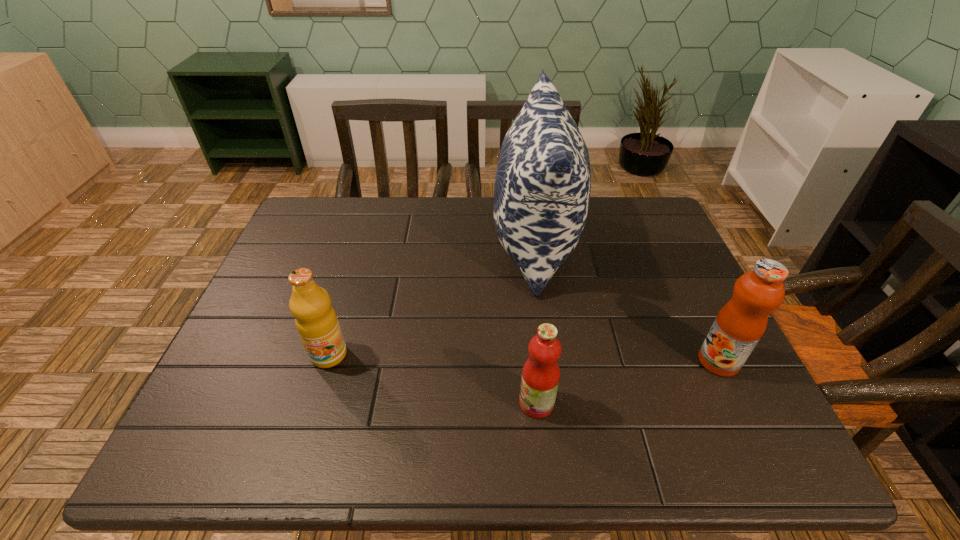
Locate an element on the screen. vacant region located 0.170m on the front label of the rightmost object is located at coordinates (621, 361).

The image size is (960, 540). In order to click on vacant space located on the front label of the rightmost object in this screenshot , I will do `click(676, 361)`.

Locate an element on the screen. vacant space located 0.110m on the front label of the leftmost fruit juice is located at coordinates (310, 416).

This screenshot has width=960, height=540. In order to click on free space located on the front label of the nearest object in this screenshot , I will do `click(361, 403)`.

I want to click on vacant area situated 0.340m on the front label of the nearest object, so click(351, 403).

The image size is (960, 540). What are the coordinates of `vacant space situated on the front label of the nearest object` in the screenshot? It's located at pos(460,403).

The image size is (960, 540). Identify the location of object at the far edge. (542, 187).

In order to click on object that is positioned at the right edge in this screenshot , I will do `click(741, 322)`.

In the image, there is a desktop. At what (x,y) coordinates should I click in order to perform the action: click on vacant space at the far edge. Please return your answer as a coordinate pair (x, y). Image resolution: width=960 pixels, height=540 pixels. Looking at the image, I should click on (447, 232).

At what (x,y) coordinates should I click in order to perform the action: click on free space at the near edge. Please return your answer as a coordinate pair (x, y). The width and height of the screenshot is (960, 540). Looking at the image, I should click on (321, 461).